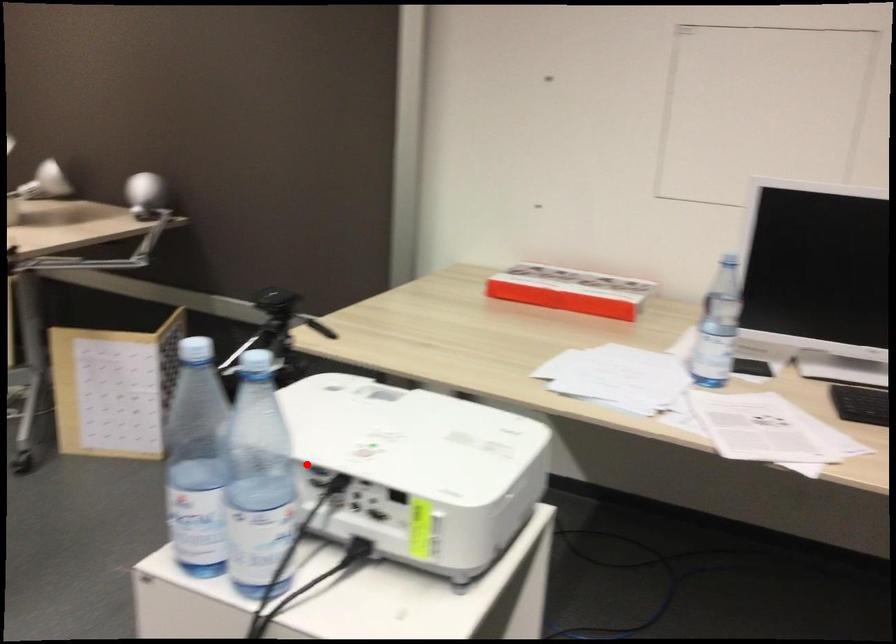
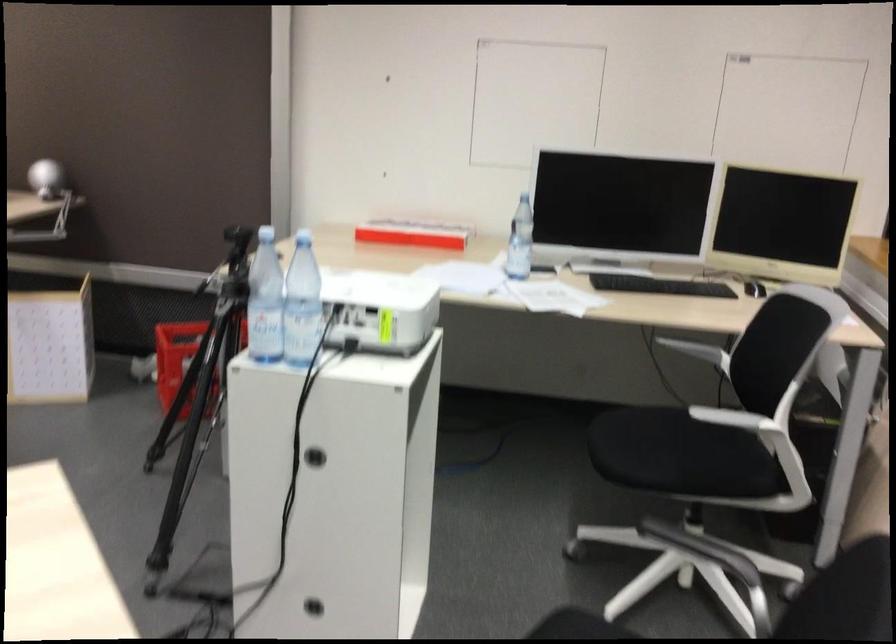
In the second image, find the point that corresponds to the highlighted location in the first image.

(302, 303)